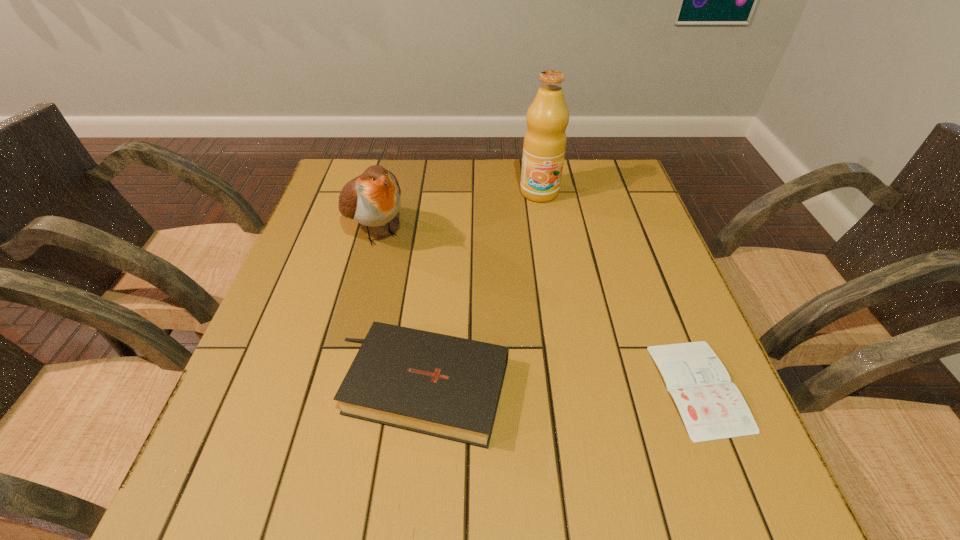
What are the coordinates of `vacant space on the desktop that is between the Bible and the diary and is positioned at the face of the second farthest object` in the screenshot? It's located at (518, 387).

Image resolution: width=960 pixels, height=540 pixels. In order to click on free spot on the desktop that is between the third tallest object and the diary and is positioned on the front label of the farthest object in this screenshot , I will do `click(562, 387)`.